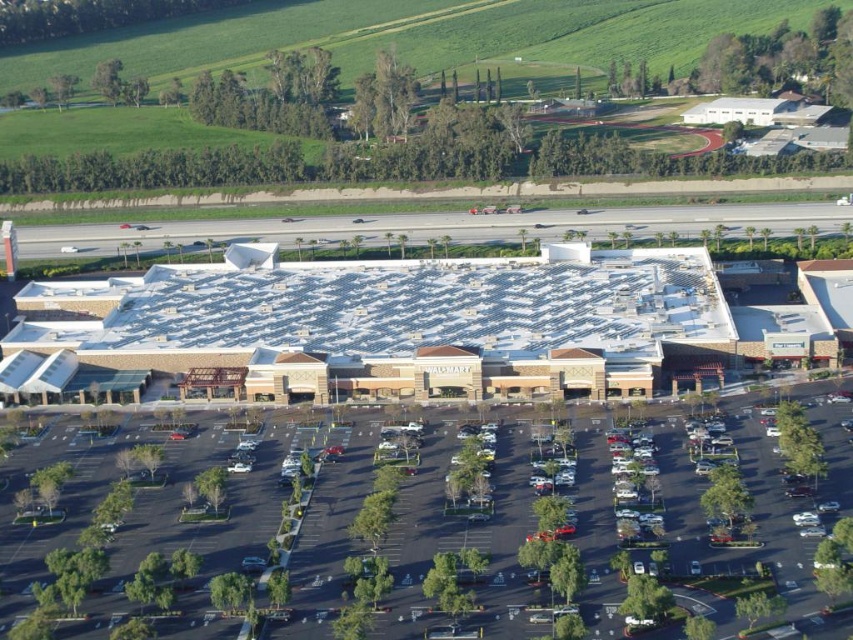
Is black asphalt parking lot at center to the left of dark gray asphalt parking lot at center from the viewer's perspective?

No, black asphalt parking lot at center is not to the left of dark gray asphalt parking lot at center.

Which of these two, black asphalt parking lot at center or dark gray asphalt parking lot at center, stands shorter?

With less height is dark gray asphalt parking lot at center.

Is point (527, 435) less distant than point (421, 221)?

Yes, it is.

Locate an element on the screen. The width and height of the screenshot is (853, 640). black asphalt parking lot at center is located at coordinates (459, 538).

Where is `brown stone building at center`? The width and height of the screenshot is (853, 640). brown stone building at center is located at coordinates (425, 323).

Who is more distant from viewer, (566, 241) or (473, 547)?

The point (566, 241) is more distant.

Find the location of a particular element. The height and width of the screenshot is (640, 853). brown stone building at center is located at coordinates (425, 323).

Who is shorter, brown stone building at center or dark gray asphalt parking lot at center?

With less height is dark gray asphalt parking lot at center.

Which is in front, point (540, 292) or point (521, 228)?

Point (540, 292) is in front.

Between point (274, 371) and point (254, 225), which one is positioned in front?

Point (274, 371) is in front.

The width and height of the screenshot is (853, 640). Find the location of `brown stone building at center`. brown stone building at center is located at coordinates (425, 323).